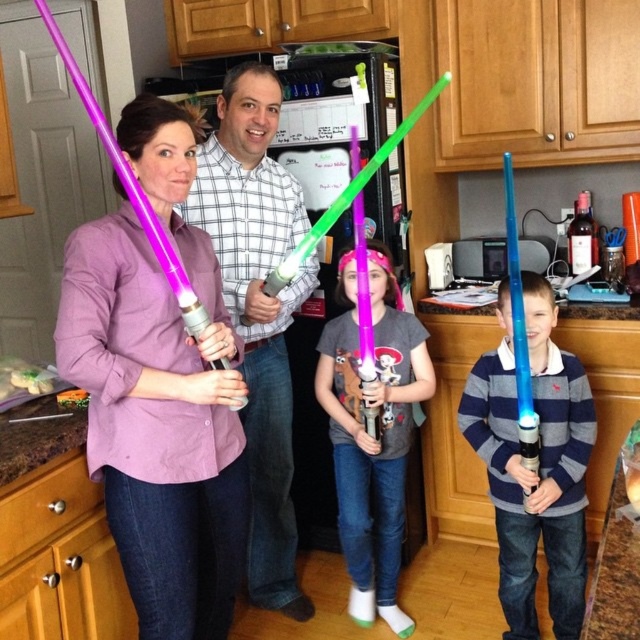
From the picture: You are organizing a lightsaber display in the kitchen. The blue translucent light saber at center and the matte purple lightsaber at center need to be placed on a shelf. If the shelf has limited space, which lightsaber should you choose to fit first?

The blue translucent light saber at center should be placed first because it occupies less space than the matte purple lightsaber at center.

You are standing in the kitchen and need to place the matte green plastic lightsaber at center on the black refrigerator in the background. Based on its current position, will you have to move it to the left or right to align it with the fridge?

The matte green plastic lightsaber at center is located at point (257, 308), so you would need to move it to the right to align it with the black refrigerator in the background.